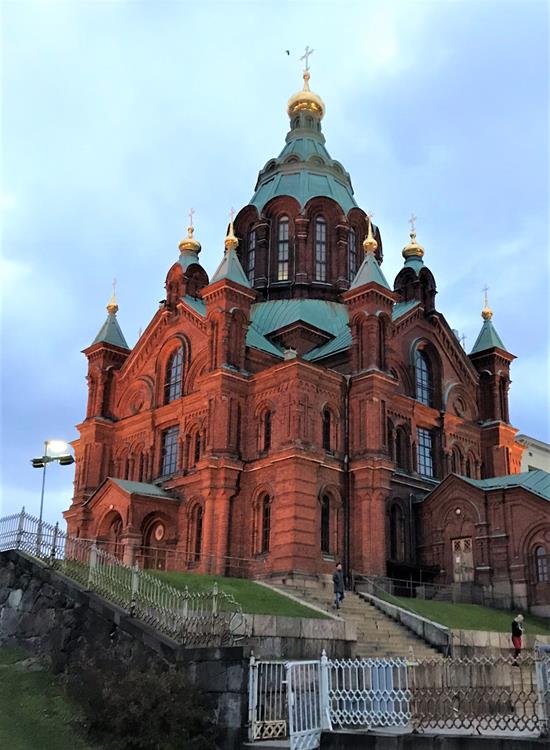
Where is `small wall`? Image resolution: width=550 pixels, height=750 pixels. small wall is located at coordinates (88, 628), (301, 645), (498, 649).